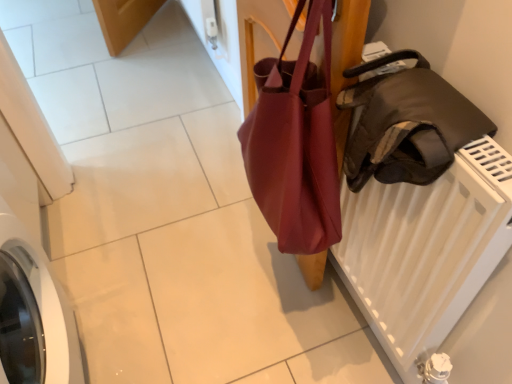
Find the location of `vacant space underneath leather jacket at right (from a real-world perspective)`. vacant space underneath leather jacket at right (from a real-world perspective) is located at coordinates pos(345,317).